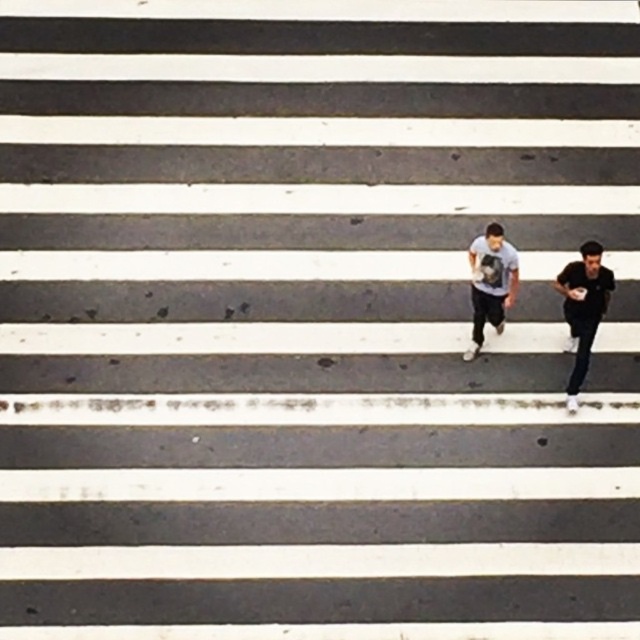
Can you confirm if dark gray fabric pants at right is positioned above light blue cotton t-shirt at center?

No, dark gray fabric pants at right is not above light blue cotton t-shirt at center.

Is point (573, 365) in front of point (516, 284)?

No, (573, 365) is behind (516, 284).

Identify the location of dark gray fabric pants at right. This screenshot has width=640, height=640. (582, 308).